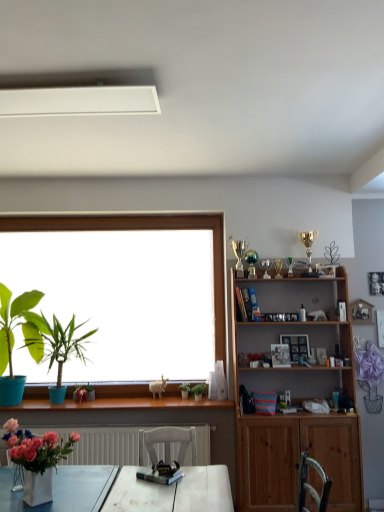
Question: Is green matte plant at center, marked as the first houseplant in a right-to-left arrangement, in front of or behind matte green plant at left, which is counted as the fourth houseplant, starting from the right, in the image?

Choices:
 (A) front
 (B) behind

Answer: (B)

Question: From a real-world perspective, is green matte plant at center, marked as the first houseplant in a right-to-left arrangement, positioned above or below matte green plant at left, the first houseplant from the left?

Choices:
 (A) above
 (B) below

Answer: (B)

Question: Estimate the real-world distances between objects in this image. Which object is farther from the wooden picture frame at upper right, which is the 2th picture frame from front to back?

Choices:
 (A) wooden picture frame at upper right, the 2th picture frame when ordered from right to left
 (B) matte blue pot at left, the 2th houseplant when ordered from left to right
 (C) matte green plant at left, which is counted as the fourth houseplant, starting from the right
 (D) wooden shelf at right
 (E) white matte exhaust hood at upper center

Answer: (E)

Question: Which object is the farthest from the green matte houseplant at center, the second houseplant in the right-to-left sequence?

Choices:
 (A) matte green plant at left, the first houseplant from the left
 (B) matte blue pot at left, the 2th houseplant when ordered from left to right
 (C) green matte plant at center, arranged as the 4th houseplant when viewed from the left
 (D) wooden picture frame at upper right, the 2th picture frame when ordered from right to left
 (E) wooden shelf at right

Answer: (A)